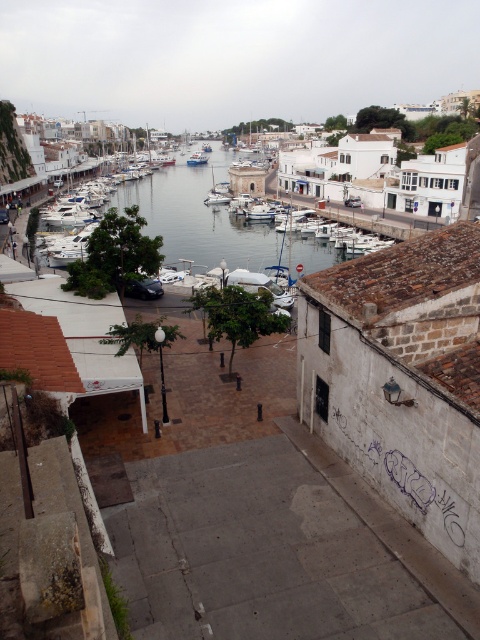
You are a photographer planning to capture the waterfront scene. You want to ensure that both the white matte boat at center and the white glossy boat at center are fully visible in your shot. Based on their heights, which boat might require you to adjust your camera angle to avoid being blocked by the other?

The white matte boat at center is not as tall as the white glossy boat at center, so you might need to adjust your camera angle to ensure the shorter white matte boat at center isn not blocked by the taller white glossy boat at center.

You are standing at the top of the stairs looking down towards the waterfront. There are two points marked in the scene. The first point is at coordinates point (244, 211) and the second is at point (204, 161). Which point is closer to you?

Point (244, 211) is in front of point (204, 161), so it is closer to you.